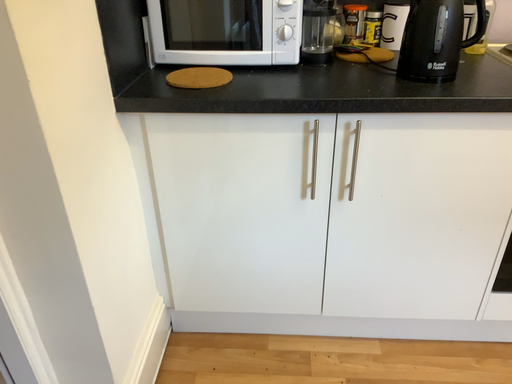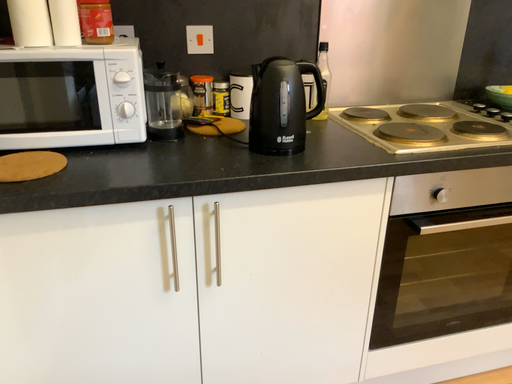
Question: How did the camera likely rotate when shooting the video?

Choices:
 (A) rotated downward
 (B) rotated upward

Answer: (B)